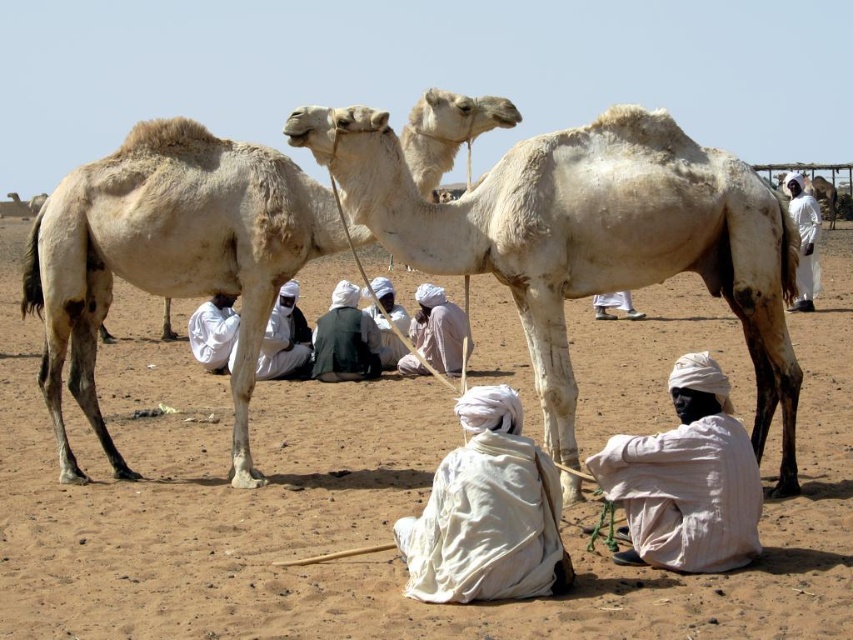
You are a photographer standing at the camera position. You want to take a closeup shot of the light beige fabric turban at center. Can you determine if you can focus on it clearly without moving your position?

The light beige fabric turban at center is 9.99 meters from camera, so you can focus on it clearly without moving your position as it is within the camera focus range.

In the scene shown: You are a photographer trying to capture a group photo of the two people wearing the light beige fabric turban at center and the white cloth turban at center. The camera you are using has a minimum focus distance of 15 inches. Can you take a clear photo of both turbans without moving either person?

The light beige fabric turban at center and the white cloth turban at center are 14.76 inches apart, which is less than the camera minimum focus distance of 15 inches. Therefore, you can take a clear photo of both turbans without moving either person.

You are standing in the desert scene described. You see the brown sandy dirt at center and the white fabric turban at lower center. Which object is positioned to the left of the other?

The brown sandy dirt at center is to the left of the white fabric turban at lower center.